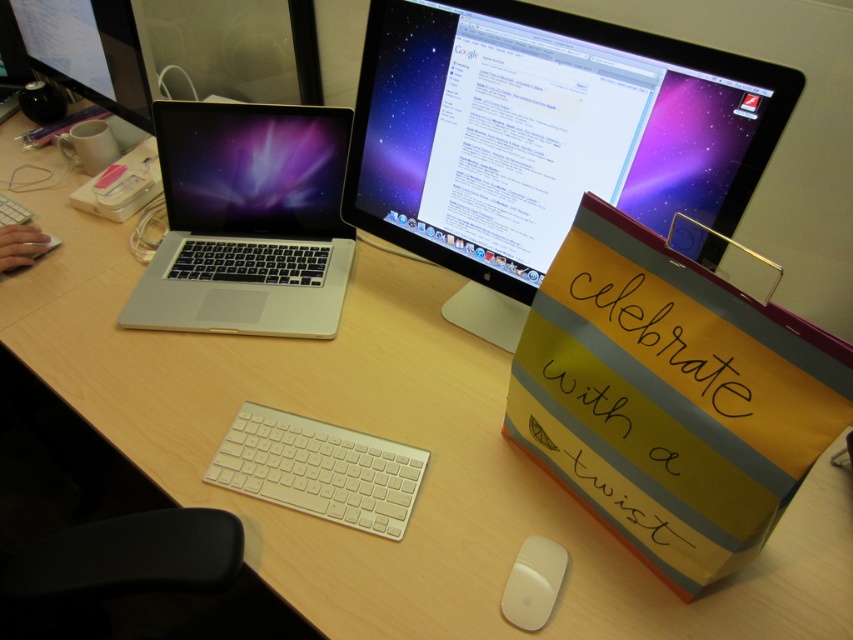
You are a delivery robot with a width of 0.5 meters. You need to deliver a small package to the desk. The package must be placed precisely at the point marked as point (193, 256). However, there are obstacles in the way. The white Apple Magic Keyboard and the white Apple Magic Mouse are on the desk. Can you navigate through the space between them to reach the point?

The distance between the white Apple Magic Keyboard and the white Apple Magic Mouse is 1.16 meters. Since the robot is 0.5 meters wide, it can safely navigate through the space between them to reach point (193, 256).

You are organizing a tech showcase and need to stack the silver metallic laptop at left and the matte black laptop at left vertically. Which one should you place at the bottom to ensure stability?

You should place the silver metallic laptop at left at the bottom because it is taller than the matte black laptop at left, providing a more stable base.

You are organizing your desk and want to place the silver metallic laptop at left and the matte black laptop at left side by side. Which laptop will occupy more horizontal space on the desk?

The silver metallic laptop at left has a greater width than the matte black laptop at left, so it will occupy more horizontal space on the desk.